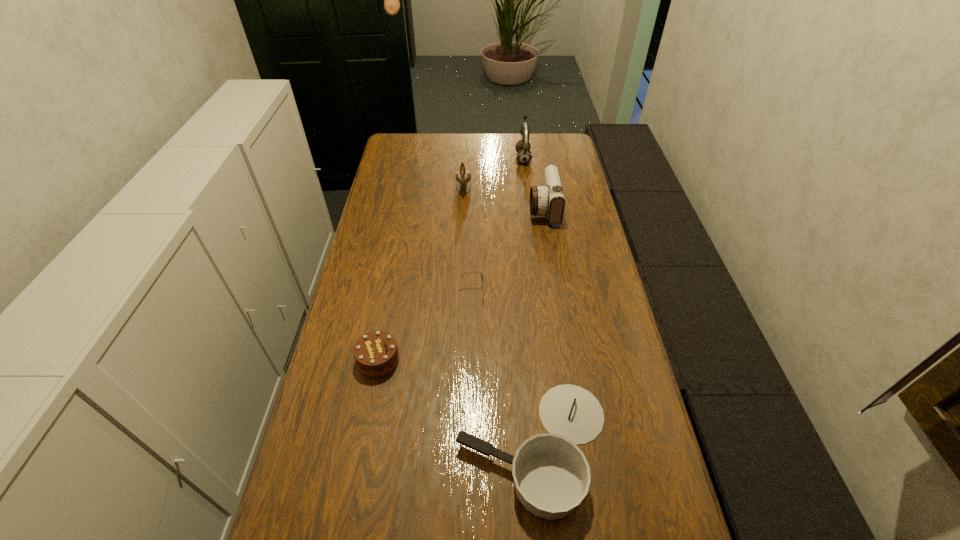
This screenshot has height=540, width=960. Identify the location of vacant area located on the ear pads of the farthest object. (444, 158).

Where is `vacant area situated 0.180m at the face of the bird`? The image size is (960, 540). vacant area situated 0.180m at the face of the bird is located at coordinates (462, 230).

Identify the location of vacant space located on the surface of the camcorder. (484, 209).

Where is `free space located 0.110m on the surface of the camcorder`? free space located 0.110m on the surface of the camcorder is located at coordinates (499, 209).

Where is `blank space located 0.370m on the surface of the camcorder`? The image size is (960, 540). blank space located 0.370m on the surface of the camcorder is located at coordinates (430, 209).

Image resolution: width=960 pixels, height=540 pixels. I want to click on free space located on the front of the chocolate cake, so click(x=368, y=417).

Where is `blank area located in front of the lenses of the sunglasses`? This screenshot has height=540, width=960. blank area located in front of the lenses of the sunglasses is located at coordinates (595, 293).

The width and height of the screenshot is (960, 540). What are the coordinates of `vacant space located 0.060m on the left of the nearest object` in the screenshot? It's located at (430, 447).

Where is `object at the far edge`? object at the far edge is located at coordinates (524, 156).

Find the location of a particular element. object at the left edge is located at coordinates (376, 353).